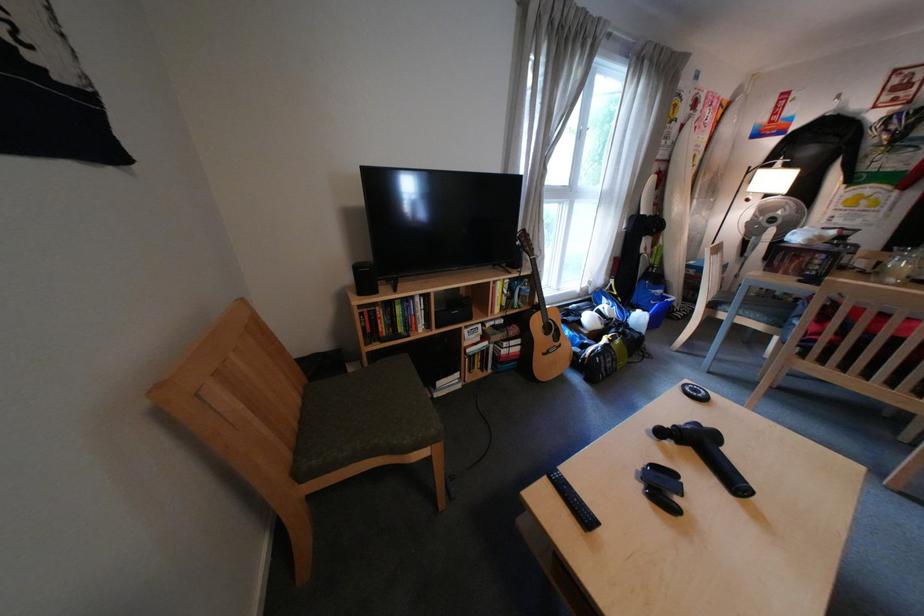
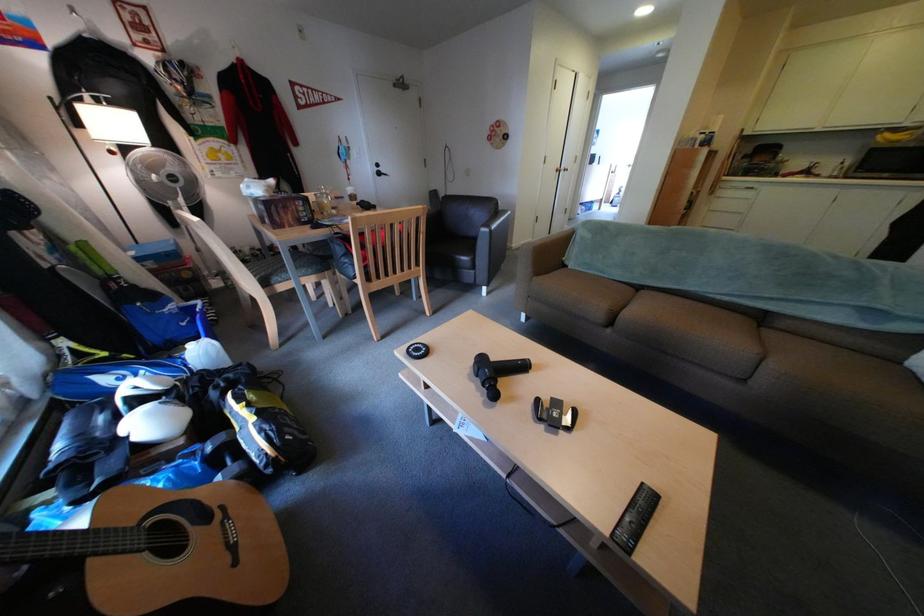
Where in the second image is the point corresponding to point (563, 318) from the first image?

(148, 527)